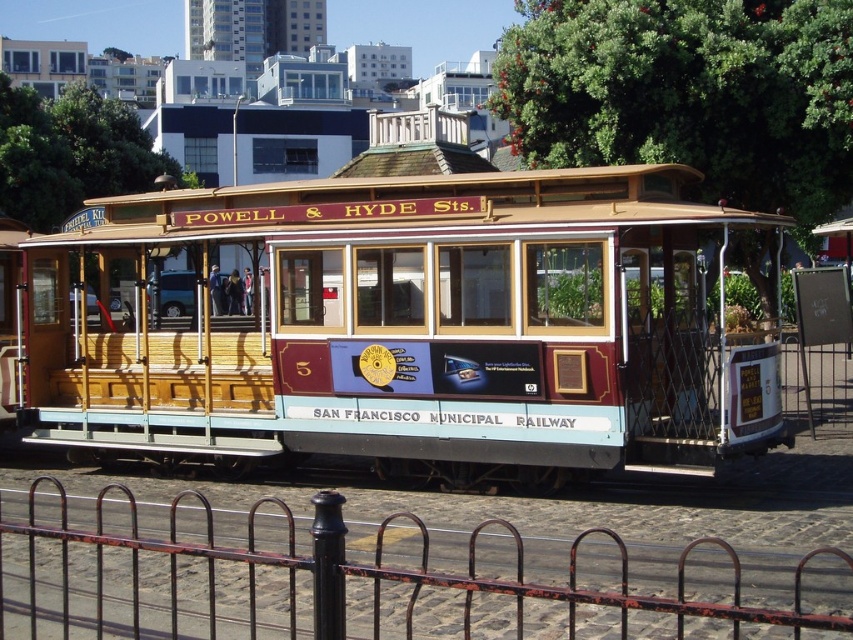
Between point (387, 296) and point (618, 602), which one is positioned behind?

The point (387, 296) is behind.

From the picture: Who is positioned more to the left, wooden cable car at center or rusty metal fence at lower center?

Positioned to the left is rusty metal fence at lower center.

Identify the location of wooden cable car at center. The image size is (853, 640). (404, 324).

Identify the location of wooden cable car at center. This screenshot has width=853, height=640. (404, 324).